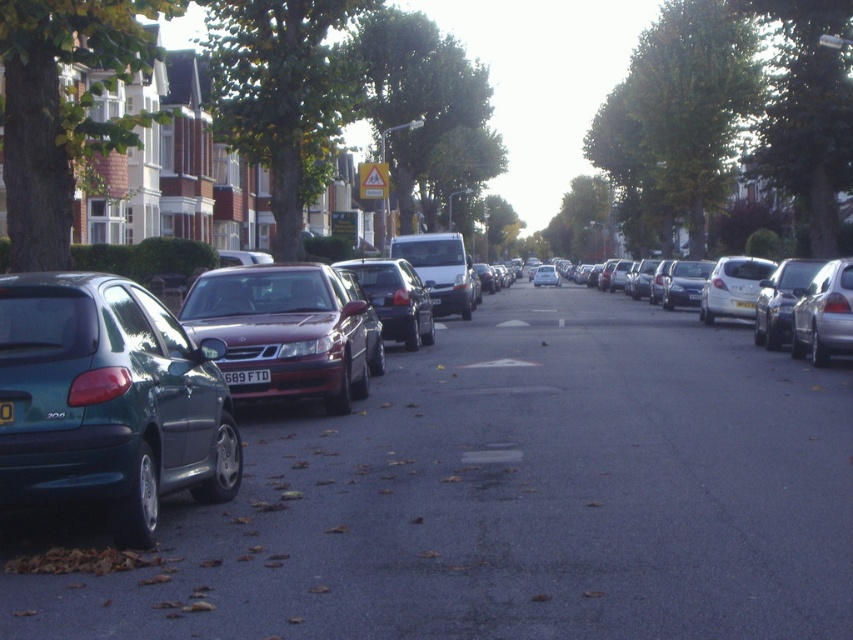
Question: Which point is farther from the camera taking this photo?

Choices:
 (A) (1, 412)
 (B) (13, 481)

Answer: (B)

Question: Is shiny metallic sedan at center-left below black plastic license plate at center?

Choices:
 (A) yes
 (B) no

Answer: (B)

Question: Which point is closer to the camera?

Choices:
 (A) click(418, 301)
 (B) click(102, 499)

Answer: (B)

Question: Which object is positioned closest to the white plastic license plate at center?

Choices:
 (A) metallic silver sedan at right
 (B) shiny metallic sedan at center-left
 (C) satin red sedan at center

Answer: (A)

Question: Is teal glossy hatchback at left positioned at the back of green matte license plate at left?

Choices:
 (A) no
 (B) yes

Answer: (B)

Question: Is teal glossy hatchback at left thinner than white plastic license plate at center?

Choices:
 (A) no
 (B) yes

Answer: (A)